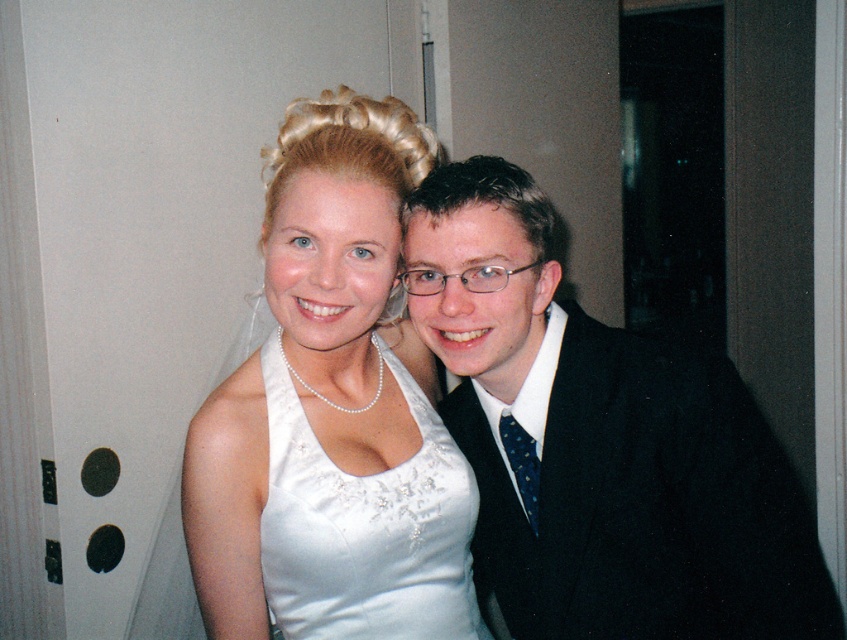
Looking at this image, measure the distance between point (352,188) and camera.

Point (352,188) is 39.07 inches from camera.

At what (x,y) coordinates should I click in order to perform the action: click on white satin dress at center. Please return your answer as a coordinate pair (x, y). This screenshot has height=640, width=847. Looking at the image, I should click on click(331, 412).

Which is below, shiny black suit at right or dark blue dotted tie at center?

Positioned lower is shiny black suit at right.

Between shiny black suit at right and dark blue dotted tie at center, which one is positioned higher?

dark blue dotted tie at center

Who is more distant from viewer, (618, 385) or (538, 465)?

The point (538, 465) is more distant.

You are a GUI agent. You are given a task and a screenshot of the screen. Output one action in this format:
    pyautogui.click(x=<x>, y=<y>)
    Task: Click on the shiny black suit at right
    This screenshot has width=847, height=640.
    Given the screenshot: What is the action you would take?
    pyautogui.click(x=601, y=442)

Find the location of a particular element. This screenshot has height=640, width=847. shiny black suit at right is located at coordinates (601, 442).

This screenshot has width=847, height=640. What do you see at coordinates (601, 442) in the screenshot?
I see `shiny black suit at right` at bounding box center [601, 442].

You are a GUI agent. You are given a task and a screenshot of the screen. Output one action in this format:
    pyautogui.click(x=<x>, y=<y>)
    Task: Click on the shiny black suit at right
    The width and height of the screenshot is (847, 640).
    Given the screenshot: What is the action you would take?
    pyautogui.click(x=601, y=442)